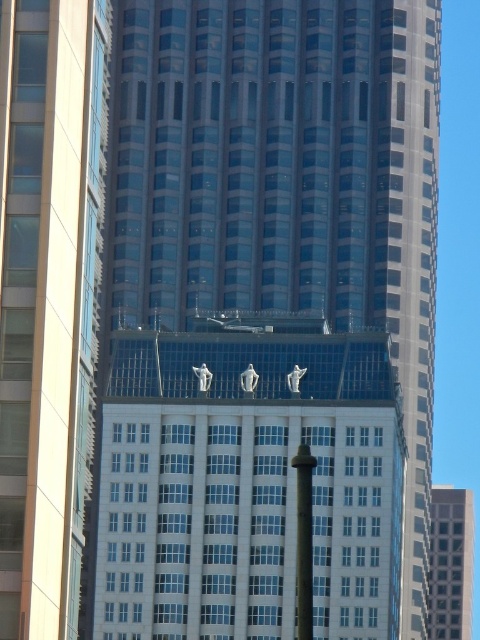
Which is in front, point (14, 122) or point (446, 490)?

Positioned in front is point (14, 122).

Can you confirm if glassy steel skyscraper at center is positioned below glassy reflective skyscraper at center?

No, glassy steel skyscraper at center is not below glassy reflective skyscraper at center.

Which is in front, point (28, 534) or point (467, 621)?

Point (28, 534) is in front.

Locate an element on the screen. glassy steel skyscraper at center is located at coordinates (48, 300).

This screenshot has height=640, width=480. What do you see at coordinates (268, 316) in the screenshot? I see `white glass building at center` at bounding box center [268, 316].

Between white glass building at center and glassy reflective skyscraper at center, which one appears on the left side from the viewer's perspective?

white glass building at center

In order to click on white glass building at center in this screenshot , I will do `click(268, 316)`.

Is white glass building at center to the left of glassy steel skyscraper at center from the viewer's perspective?

No, white glass building at center is not to the left of glassy steel skyscraper at center.

Does point (126, 61) come closer to viewer compared to point (1, 358)?

No, it is behind (1, 358).

I want to click on white glass building at center, so click(x=268, y=316).